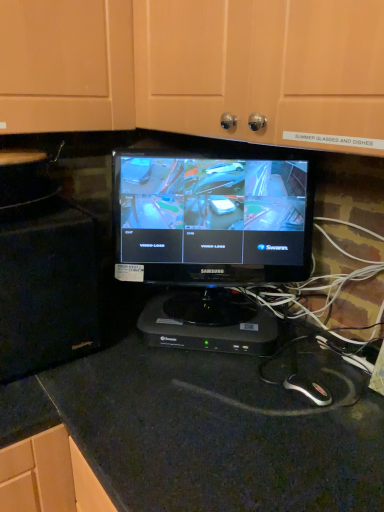
Question: Is matte black monitor at center outside black granite countertop at center?

Choices:
 (A) no
 (B) yes

Answer: (B)

Question: From the image's perspective, is matte black monitor at center on black granite countertop at center?

Choices:
 (A) no
 (B) yes

Answer: (B)

Question: Is black granite countertop at center inside matte black monitor at center?

Choices:
 (A) no
 (B) yes

Answer: (A)

Question: From a real-world perspective, is matte black monitor at center physically above black granite countertop at center?

Choices:
 (A) yes
 (B) no

Answer: (A)

Question: Is matte black monitor at center wider than black granite countertop at center?

Choices:
 (A) no
 (B) yes

Answer: (A)

Question: From the image's perspective, is black glossy monitor at center above or below black granite countertop at center?

Choices:
 (A) below
 (B) above

Answer: (B)

Question: Considering the positions of point (256, 208) and point (213, 475), is point (256, 208) closer or farther from the camera than point (213, 475)?

Choices:
 (A) closer
 (B) farther

Answer: (B)

Question: Is black glossy monitor at center bigger or smaller than black granite countertop at center?

Choices:
 (A) big
 (B) small

Answer: (B)

Question: From a real-world perspective, is black glossy monitor at center above or below black granite countertop at center?

Choices:
 (A) below
 (B) above

Answer: (B)

Question: From their relative heights in the image, would you say black glossy monitor at center is taller or shorter than black plastic device at center?

Choices:
 (A) tall
 (B) short

Answer: (A)

Question: Based on their sizes in the image, would you say black glossy monitor at center is bigger or smaller than black plastic device at center?

Choices:
 (A) small
 (B) big

Answer: (B)

Question: Is black glossy monitor at center wider or thinner than black plastic device at center?

Choices:
 (A) wide
 (B) thin

Answer: (B)

Question: From a real-world perspective, relative to black plastic device at center, is black glossy monitor at center vertically above or below?

Choices:
 (A) below
 (B) above

Answer: (B)

Question: Considering the relative positions of matte black monitor at center and black glossy monitor at center in the image provided, is matte black monitor at center to the left or to the right of black glossy monitor at center?

Choices:
 (A) right
 (B) left

Answer: (A)

Question: From a real-world perspective, is matte black monitor at center above or below black glossy monitor at center?

Choices:
 (A) below
 (B) above

Answer: (B)